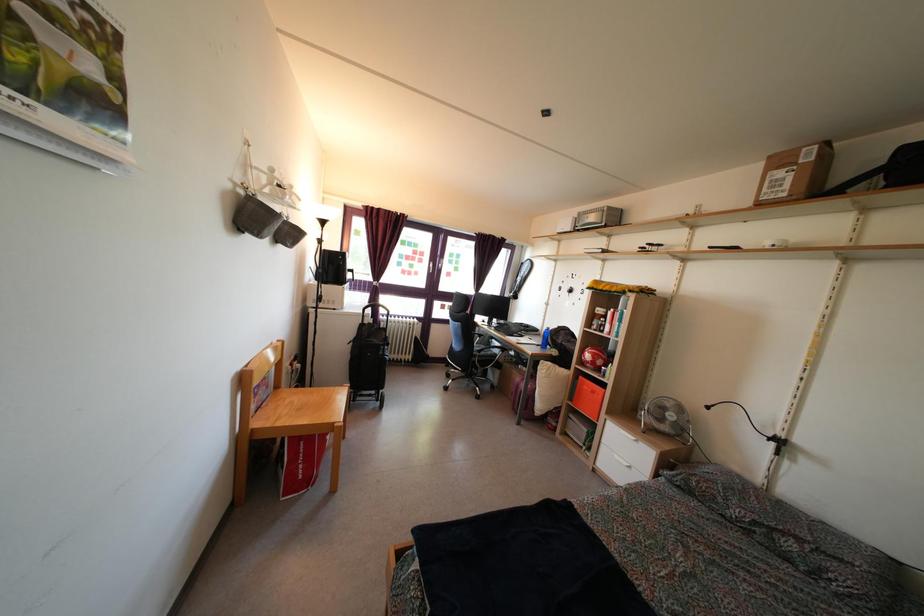
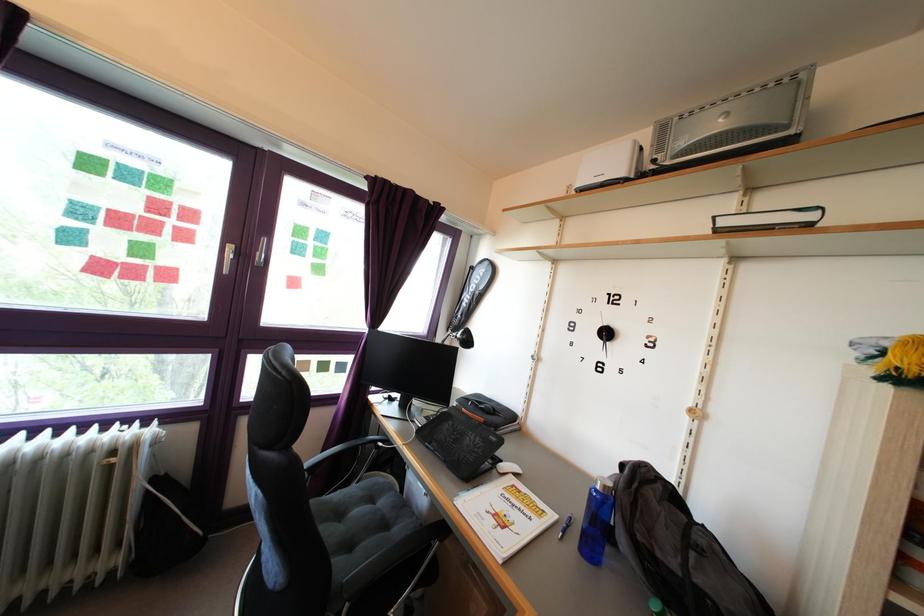
Where in the second image is the point corresponding to the point at 517,338 from the first image?

(472, 447)